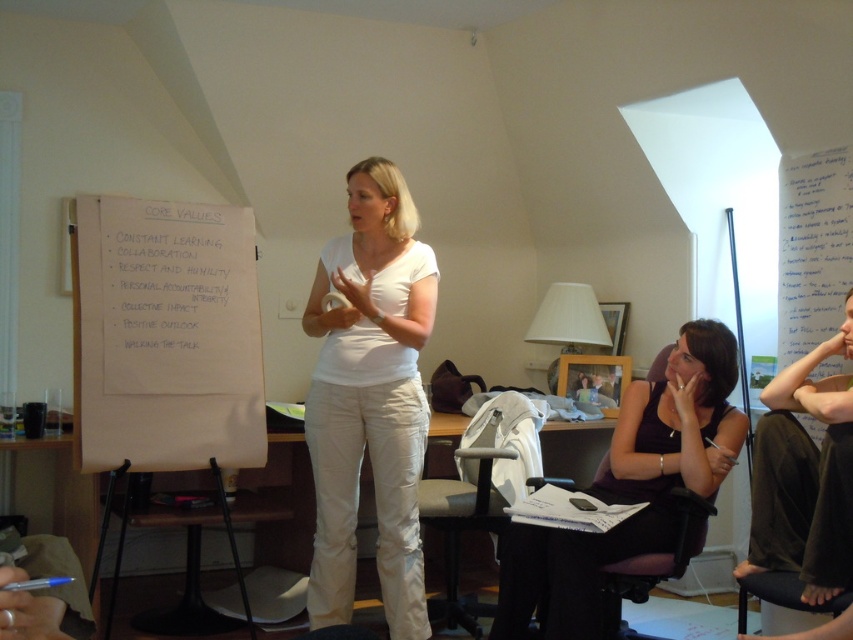
Question: Among these points, which one is nearest to the camera?

Choices:
 (A) (802, 369)
 (B) (241, 445)
 (C) (337, 310)

Answer: (A)

Question: Does white cotton shirt at center have a smaller size compared to matte purple dress at lower right?

Choices:
 (A) yes
 (B) no

Answer: (A)

Question: Among these points, which one is nearest to the camera?

Choices:
 (A) (830, 500)
 (B) (224, 417)

Answer: (A)

Question: Does white cotton shirt at center appear on the right side of dark purple fabric dress at lower right?

Choices:
 (A) yes
 (B) no

Answer: (B)

Question: Which point is closer to the camera?

Choices:
 (A) (808, 596)
 (B) (323, 432)

Answer: (A)

Question: Can you confirm if matte purple dress at lower right is smaller than dark purple fabric dress at lower right?

Choices:
 (A) yes
 (B) no

Answer: (B)